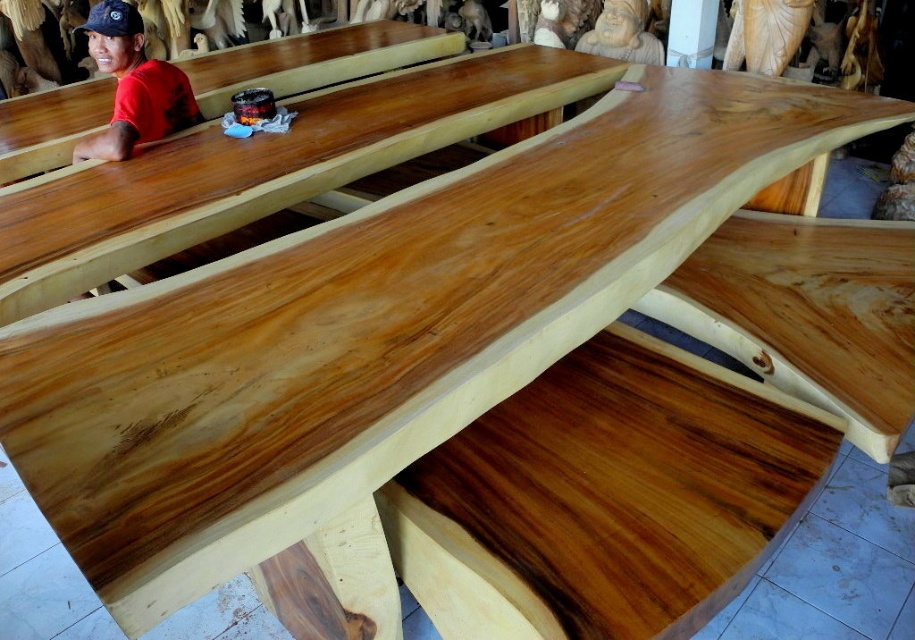
Is glossy wood table at upper center taller than natural wood table at left?

Indeed, glossy wood table at upper center has a greater height compared to natural wood table at left.

Is point (154, 156) closer to camera compared to point (296, 84)?

Yes, it is.

At what (x,y) coordinates should I click in order to perform the action: click on glossy wood table at upper center. Please return your answer as a coordinate pair (x, y). The height and width of the screenshot is (640, 915). Looking at the image, I should click on (262, 168).

At what (x,y) coordinates should I click in order to perform the action: click on glossy wood table at upper center. Please return your answer as a coordinate pair (x, y). This screenshot has height=640, width=915. Looking at the image, I should click on click(x=262, y=168).

Based on the photo, does polished wood plank at center appear on the left side of red matte shirt at left?

In fact, polished wood plank at center is to the right of red matte shirt at left.

This screenshot has width=915, height=640. I want to click on polished wood plank at center, so click(615, 490).

Identify the location of polished wood plank at center. pos(615,490).

Does matte brown statue at upper center have a greater width compared to black fabric baseball cap at upper left?

No.

Is matte brown statue at upper center bigger than black fabric baseball cap at upper left?

Correct, matte brown statue at upper center is larger in size than black fabric baseball cap at upper left.

Find the location of `matte brown statue at upper center`. matte brown statue at upper center is located at coordinates (623, 33).